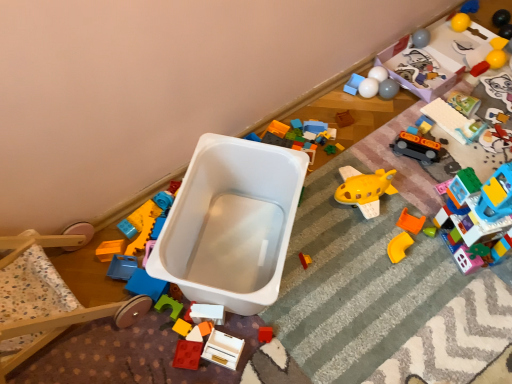
The width and height of the screenshot is (512, 384). In order to click on free space that is to the left of orange matte plastic corner piece at lower right, the ninth toy positioned from the right in this screenshot , I will do `click(343, 250)`.